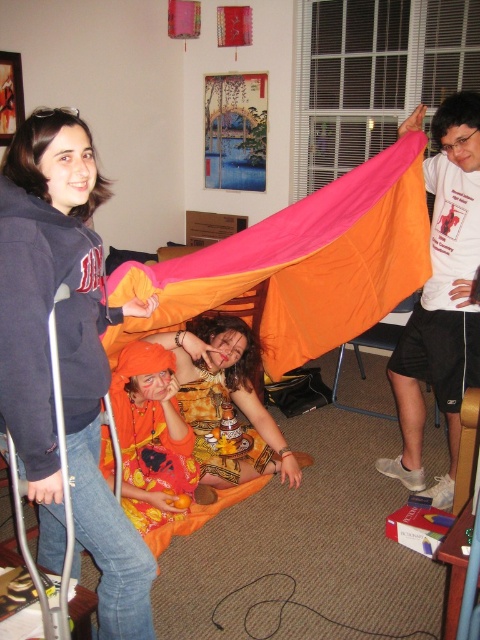
Question: Among these objects, which one is nearest to the camera?

Choices:
 (A) matte black hoodie at left
 (B) pink fabric tent at center

Answer: (A)

Question: In this image, where is matte black hoodie at left located relative to orange fabric at center?

Choices:
 (A) left
 (B) right

Answer: (A)

Question: Does matte black hoodie at left appear over pink fabric tent at center?

Choices:
 (A) yes
 (B) no

Answer: (B)

Question: Can you confirm if matte black hoodie at left is positioned to the right of orange fabric at lower left?

Choices:
 (A) no
 (B) yes

Answer: (A)

Question: Estimate the real-world distances between objects in this image. Which object is farther from the orange fabric at center?

Choices:
 (A) pink fabric tent at center
 (B) orange fabric at lower left
 (C) matte black hoodie at left

Answer: (C)

Question: Which point is closer to the camera taking this photo?

Choices:
 (A) (372, 310)
 (B) (75, 125)
 (C) (180, 484)
 (D) (208, 477)

Answer: (B)